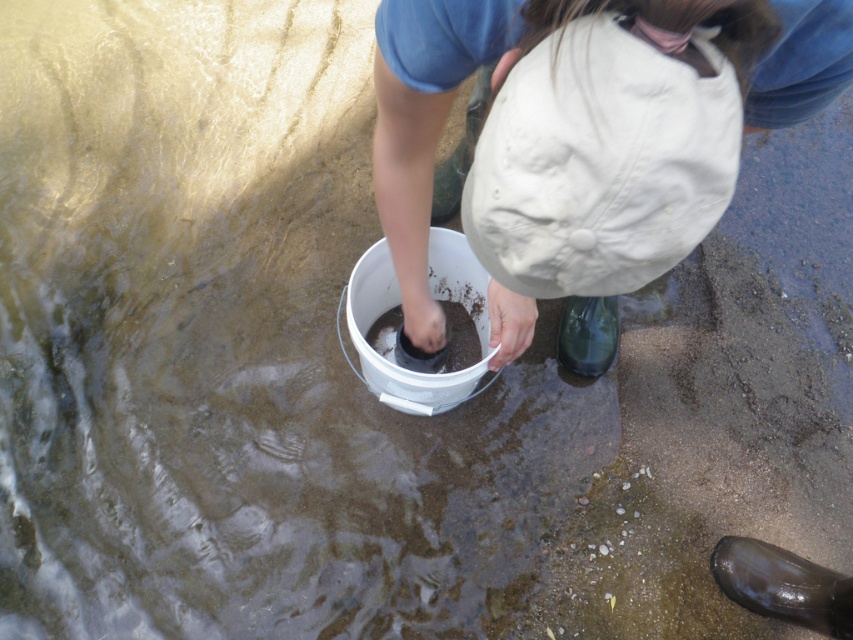
Can you confirm if white matte hat at center is wider than transparent plastic bottle at lower right?

Indeed, white matte hat at center has a greater width compared to transparent plastic bottle at lower right.

Is point (811, 84) more distant than point (601, 337)?

No.

The width and height of the screenshot is (853, 640). Describe the element at coordinates (425, 122) in the screenshot. I see `white matte hat at center` at that location.

What are the coordinates of `white matte hat at center` in the screenshot? It's located at (425, 122).